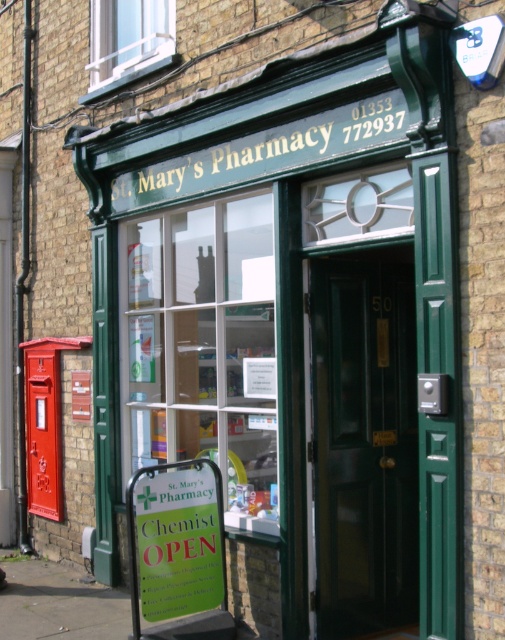
Question: Which of the following is the closest to the observer?

Choices:
 (A) shiny dark wood door at center
 (B) green paper sign at lower center

Answer: (B)

Question: Which point is farther to the camera?

Choices:
 (A) (328, 564)
 (B) (181, 605)

Answer: (A)

Question: Is shiny dark wood door at center thinner than green paper sign at lower center?

Choices:
 (A) no
 (B) yes

Answer: (A)

Question: Is shiny dark wood door at center wider than green paper sign at lower center?

Choices:
 (A) no
 (B) yes

Answer: (B)

Question: Which point is closer to the camera?

Choices:
 (A) green paper sign at lower center
 (B) shiny dark wood door at center

Answer: (A)

Question: Is shiny dark wood door at center above green paper sign at lower center?

Choices:
 (A) no
 (B) yes

Answer: (B)